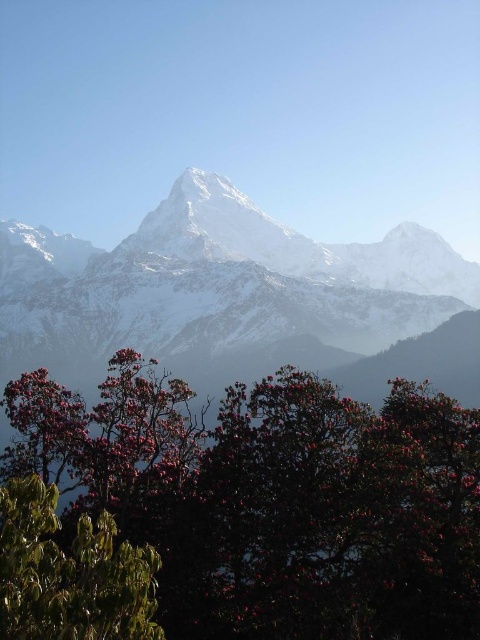
You are standing at the base of the mountain and looking at two points marked in the image. The first point is at coordinates point (x=314, y=580) and the second is at point (x=411, y=236). Which point is closer to your current position?

Point (x=314, y=580) is closer to the camera than point (x=411, y=236), so the first point is closer to your current position.

You are a hiker trying to navigate through the mountain area. You see the dark green leafy tree at center and the green glossy leaves at lower left. Which one is wider?

The dark green leafy tree at center is wider than the green glossy leaves at lower left.